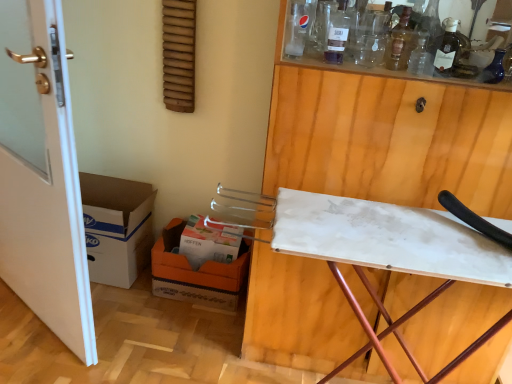
Identify the location of free space in front of white cardboard box at left, the 2th cardboard box positioned from the right. (98, 309).